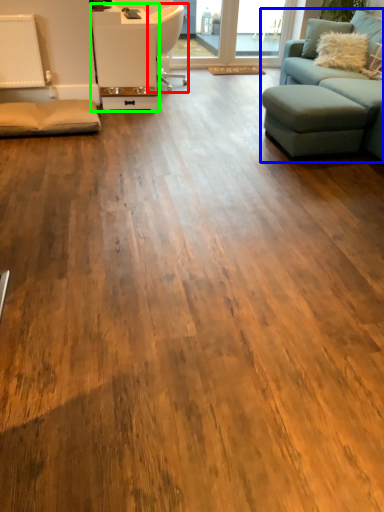
Question: Which object is positioned closest to chair (highlighted by a red box)? Select from studio couch (highlighted by a blue box) and table (highlighted by a green box).

Choices:
 (A) studio couch
 (B) table

Answer: (B)